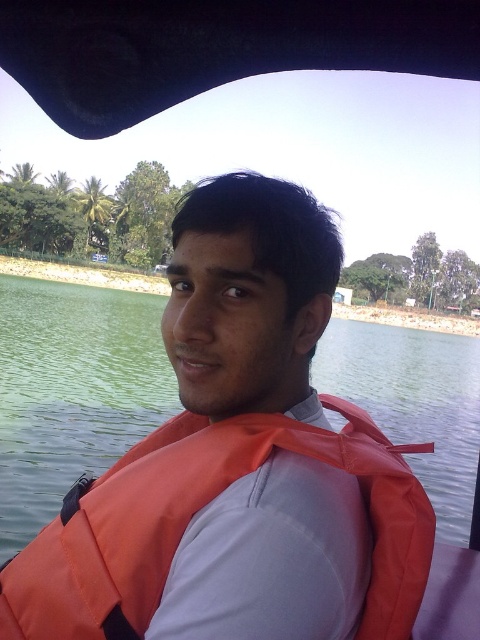
Question: Which point is farther from the camera taking this photo?

Choices:
 (A) (396, 429)
 (B) (309, 429)

Answer: (A)

Question: Is green water at center above orange fabric life jacket at center?

Choices:
 (A) yes
 (B) no

Answer: (A)

Question: Is green water at center thinner than orange fabric life jacket at center?

Choices:
 (A) yes
 (B) no

Answer: (B)

Question: Which object is farther from the camera taking this photo?

Choices:
 (A) orange fabric life jacket at center
 (B) green water at center

Answer: (B)

Question: Is green water at center above orange fabric life jacket at center?

Choices:
 (A) yes
 (B) no

Answer: (A)